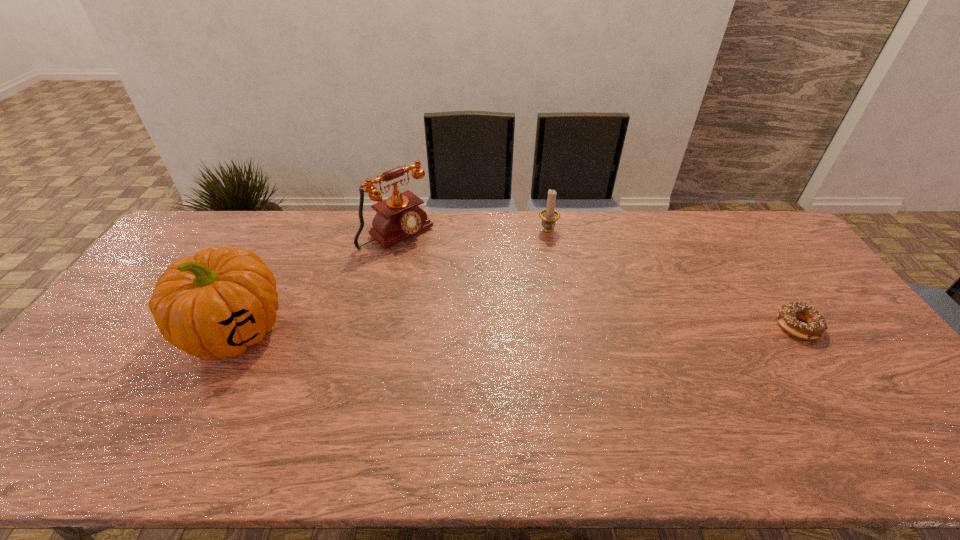
The width and height of the screenshot is (960, 540). I want to click on vacant region between the candle_holder and the rightmost object, so click(x=673, y=279).

Identify which object is the third nearest to the candle_holder. Please provide its 2D coordinates. Your answer should be formatted as a tuple, i.e. [(x, y)], where the tuple contains the x and y coordinates of a point satisfying the conditions above.

[(213, 306)]

Locate an element on the screen. Image resolution: width=960 pixels, height=540 pixels. object that ranks as the second closest to the shortest object is located at coordinates (398, 217).

Locate an element on the screen. This screenshot has width=960, height=540. blank area in the image that satisfies the following two spatial constraints: 1. on the back side of the third object from right to left; 2. on the left side of the second object from right to left is located at coordinates (397, 232).